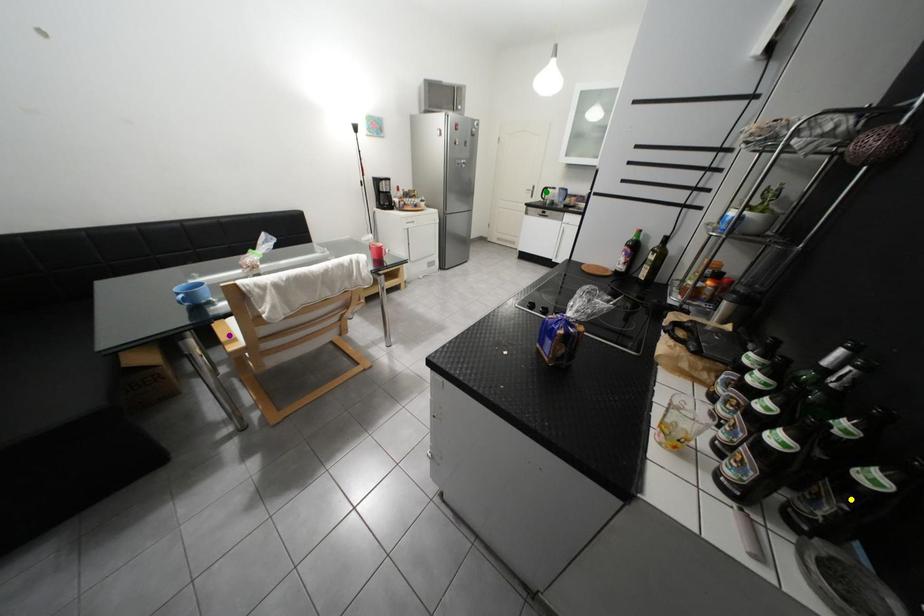
Order these from farthest to nearest:
green point | yellow point | purple point

green point < purple point < yellow point